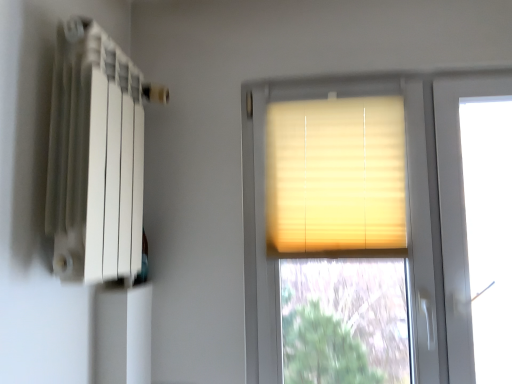
Question: Is matte yellow blinds at center wider or thinner than white matte radiator at left?

Choices:
 (A) thin
 (B) wide

Answer: (A)

Question: From a real-world perspective, relative to white matte radiator at left, is matte yellow blinds at center vertically above or below?

Choices:
 (A) above
 (B) below

Answer: (B)

Question: Considering the real-world distances, which object is closest to the white matte radiator at left?

Choices:
 (A) matte yellow blinds at center
 (B) beige fabric blinds at center

Answer: (B)

Question: Estimate the real-world distances between objects in this image. Which object is farther from the white matte radiator at left?

Choices:
 (A) matte yellow blinds at center
 (B) beige fabric blinds at center

Answer: (A)